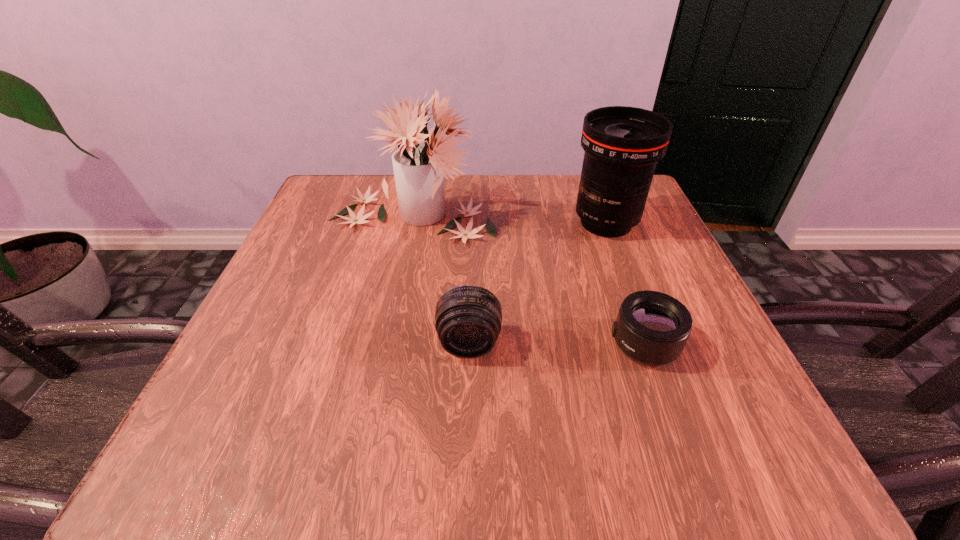
Locate an element on the screen. The image size is (960, 540). free space that is in between the farthest telephoto lens and the shortest telephoto lens is located at coordinates (625, 284).

Identify the location of free space between the shortest object and the tallest telephoto lens. This screenshot has height=540, width=960. (625, 284).

The height and width of the screenshot is (540, 960). I want to click on vacant point located between the shortest telephoto lens and the bouquet, so click(x=529, y=280).

You are a GUI agent. You are given a task and a screenshot of the screen. Output one action in this format:
    pyautogui.click(x=<x>, y=<y>)
    Task: Click on the object that ranks as the third closest to the tallest telephoto lens
    This screenshot has width=960, height=540.
    Given the screenshot: What is the action you would take?
    pyautogui.click(x=468, y=318)

Identify which object is located as the nearest to the second tallest object. Please provide its 2D coordinates. Your answer should be formatted as a tuple, i.e. [(x, y)], where the tuple contains the x and y coordinates of a point satisfying the conditions above.

[(418, 169)]

Identify which telephoto lens is located as the second nearest to the shortest telephoto lens. Please provide its 2D coordinates. Your answer should be formatted as a tuple, i.e. [(x, y)], where the tuple contains the x and y coordinates of a point satisfying the conditions above.

[(622, 144)]

The width and height of the screenshot is (960, 540). I want to click on telephoto lens that is the second closest one to the second shortest object, so click(x=622, y=144).

Find the location of `free space that satisfies the following two spatial constraints: 1. on the front side of the tallest object; 2. on the right side of the tallest telephoto lens`. free space that satisfies the following two spatial constraints: 1. on the front side of the tallest object; 2. on the right side of the tallest telephoto lens is located at coordinates (411, 223).